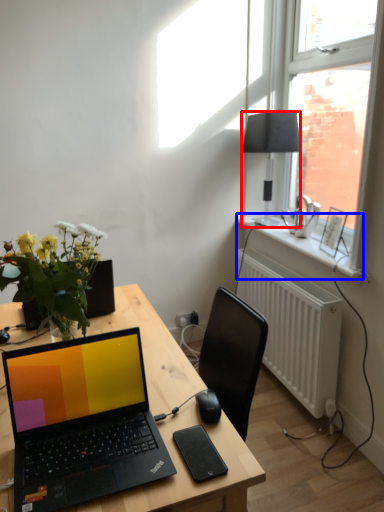
Question: Which object is further to the camera taking this photo, lamp (highlighted by a red box) or window sill (highlighted by a blue box)?

Choices:
 (A) lamp
 (B) window sill

Answer: (A)